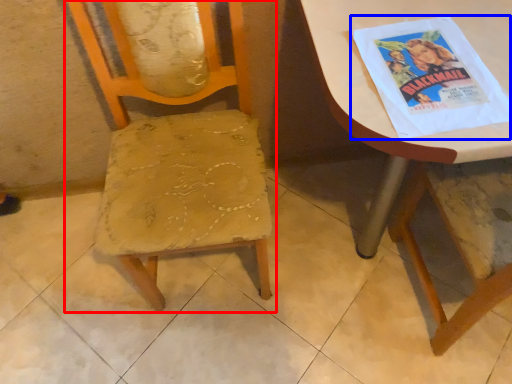
Question: Which point is closer to the camera, chair (highlighted by a red box) or comic book (highlighted by a blue box)?

Choices:
 (A) chair
 (B) comic book

Answer: (A)